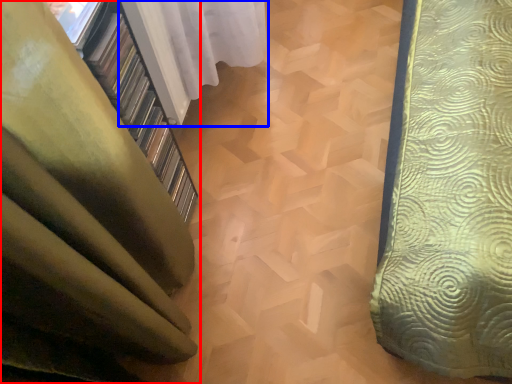
Question: Among these objects, which one is nearest to the camera, curtain (highlighted by a red box) or curtain (highlighted by a blue box)?

Choices:
 (A) curtain
 (B) curtain

Answer: (A)